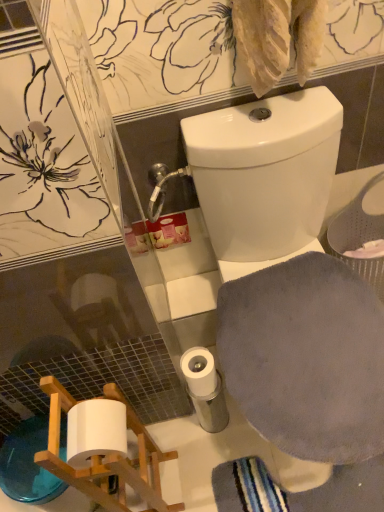
Question: Does white matte toilet paper at lower center have a greater height compared to white glossy toilet at upper center?

Choices:
 (A) no
 (B) yes

Answer: (A)

Question: Can you confirm if white matte toilet paper at lower center is positioned to the left of white glossy toilet at upper center?

Choices:
 (A) no
 (B) yes

Answer: (B)

Question: Is white matte toilet paper at lower center next to white glossy toilet at upper center?

Choices:
 (A) no
 (B) yes

Answer: (A)

Question: Can you confirm if white matte toilet paper at lower center is wider than white glossy toilet at upper center?

Choices:
 (A) yes
 (B) no

Answer: (B)

Question: From the image's perspective, does white matte toilet paper at lower center appear higher than white glossy toilet at upper center?

Choices:
 (A) no
 (B) yes

Answer: (A)

Question: Is white matte toilet paper at lower center oriented away from white glossy toilet at upper center?

Choices:
 (A) no
 (B) yes

Answer: (B)

Question: Can you confirm if gray soft cloth at lower right is bigger than white matte toilet paper at lower center?

Choices:
 (A) no
 (B) yes

Answer: (B)

Question: From a real-world perspective, is gray soft cloth at lower right positioned under white matte toilet paper at lower center based on gravity?

Choices:
 (A) yes
 (B) no

Answer: (B)

Question: Considering the relative positions of gray soft cloth at lower right and white matte toilet paper at lower center in the image provided, is gray soft cloth at lower right to the left of white matte toilet paper at lower center from the viewer's perspective?

Choices:
 (A) no
 (B) yes

Answer: (A)

Question: Is gray soft cloth at lower right outside white matte toilet paper at lower center?

Choices:
 (A) yes
 (B) no

Answer: (A)

Question: Is gray soft cloth at lower right further to the viewer compared to white matte toilet paper at lower center?

Choices:
 (A) yes
 (B) no

Answer: (B)

Question: Is gray soft cloth at lower right with white matte toilet paper at lower center?

Choices:
 (A) no
 (B) yes

Answer: (A)

Question: From a real-world perspective, is white glossy toilet at upper center on top of gray soft cloth at lower right?

Choices:
 (A) yes
 (B) no

Answer: (B)